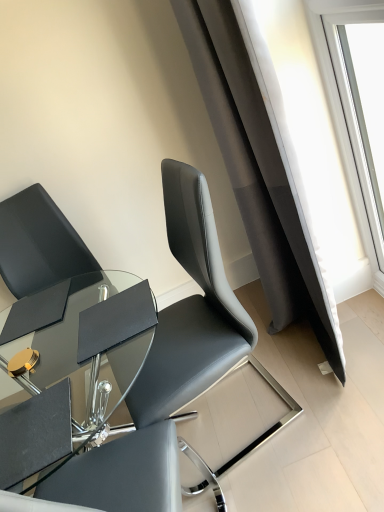
Question: From the image's perspective, is matte black chair at upper left, the second chair from the left, above or below black leather chair at left, positioned as the 2th chair in right-to-left order?

Choices:
 (A) below
 (B) above

Answer: (B)

Question: Is matte black chair at upper left, the second chair from the left, inside or outside of black leather chair at left, positioned as the 2th chair in right-to-left order?

Choices:
 (A) inside
 (B) outside

Answer: (B)

Question: Which is nearer to the transparent glass window at upper right?

Choices:
 (A) black leather chair at left, the first chair when ordered from left to right
 (B) matte black chair at upper left, the second chair from the left

Answer: (B)

Question: Which object is the farthest from the transparent glass window at upper right?

Choices:
 (A) matte black chair at upper left, the second chair from the left
 (B) black leather chair at left, positioned as the 2th chair in right-to-left order

Answer: (B)